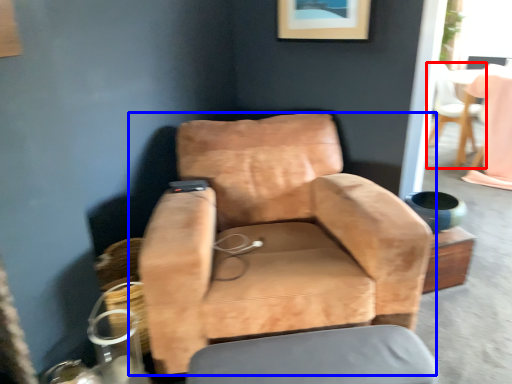
Question: Which of the following is the closest to the observer, chair (highlighted by a red box) or chair (highlighted by a blue box)?

Choices:
 (A) chair
 (B) chair

Answer: (B)